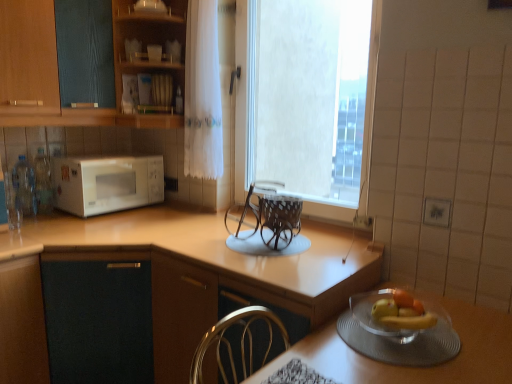
Question: From the image's perspective, is light brown laminate countertop at left located beneath wooden cabinet at upper left, the second cabinetry when ordered from right to left?

Choices:
 (A) yes
 (B) no

Answer: (A)

Question: Is light brown laminate countertop at left facing towards wooden cabinet at upper left, the second cabinetry when ordered from right to left?

Choices:
 (A) no
 (B) yes

Answer: (A)

Question: From a real-world perspective, does light brown laminate countertop at left sit lower than wooden cabinet at upper left, the second cabinetry when ordered from right to left?

Choices:
 (A) yes
 (B) no

Answer: (A)

Question: Does light brown laminate countertop at left appear on the right side of wooden cabinet at upper left, the second cabinetry when ordered from right to left?

Choices:
 (A) yes
 (B) no

Answer: (A)

Question: Are light brown laminate countertop at left and wooden cabinet at upper left, the second cabinetry when ordered from right to left, beside each other?

Choices:
 (A) no
 (B) yes

Answer: (A)

Question: Is light brown laminate countertop at left behind wooden cabinet at upper left, the second cabinetry when ordered from right to left?

Choices:
 (A) yes
 (B) no

Answer: (B)

Question: Is wooden cabinet at upper left, placed as the 1th cabinetry when sorted from left to right, outside of wooden shelves at upper center, arranged as the first cabinetry when viewed from the right?

Choices:
 (A) yes
 (B) no

Answer: (A)

Question: From the image's perspective, is wooden cabinet at upper left, placed as the 1th cabinetry when sorted from left to right, on wooden shelves at upper center, the second cabinetry from the left?

Choices:
 (A) yes
 (B) no

Answer: (B)

Question: Is wooden cabinet at upper left, the second cabinetry when ordered from right to left, smaller than wooden shelves at upper center, arranged as the first cabinetry when viewed from the right?

Choices:
 (A) yes
 (B) no

Answer: (B)

Question: From the image's perspective, would you say wooden cabinet at upper left, the second cabinetry when ordered from right to left, is shown under wooden shelves at upper center, the second cabinetry from the left?

Choices:
 (A) yes
 (B) no

Answer: (A)

Question: Does wooden cabinet at upper left, the second cabinetry when ordered from right to left, have a lesser width compared to wooden shelves at upper center, arranged as the first cabinetry when viewed from the right?

Choices:
 (A) no
 (B) yes

Answer: (B)

Question: Is wooden cabinet at upper left, the second cabinetry when ordered from right to left, oriented towards wooden shelves at upper center, arranged as the first cabinetry when viewed from the right?

Choices:
 (A) yes
 (B) no

Answer: (B)

Question: Is clear glass bottle at left, which is the 1th bottle in right-to-left order, located outside white textured window at center?

Choices:
 (A) yes
 (B) no

Answer: (A)